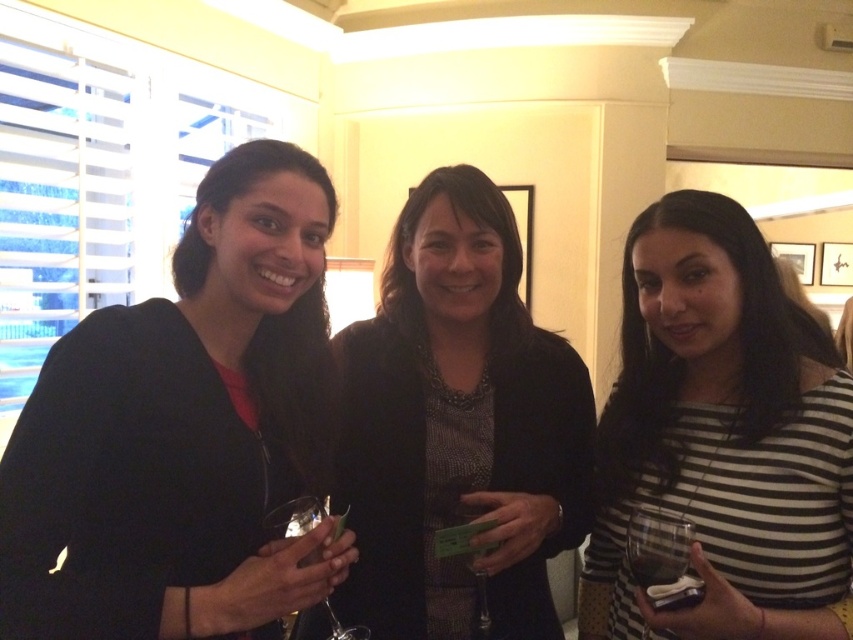
Between matte black blazer at center and clear glass wine glass at center, which one is positioned lower?

clear glass wine glass at center is below.

Which is more to the left, matte black blazer at center or clear glass wine glass at center?

From the viewer's perspective, clear glass wine glass at center appears more on the left side.

You are a GUI agent. You are given a task and a screenshot of the screen. Output one action in this format:
    pyautogui.click(x=<x>, y=<y>)
    Task: Click on the matte black blazer at center
    The height and width of the screenshot is (640, 853).
    Given the screenshot: What is the action you would take?
    pyautogui.click(x=457, y=426)

The height and width of the screenshot is (640, 853). Identify the location of matte black blazer at center. 457,426.

From the picture: Does matte black blazer at center have a larger size compared to clear glass wine glass at lower right?

Indeed, matte black blazer at center has a larger size compared to clear glass wine glass at lower right.

What do you see at coordinates (457, 426) in the screenshot?
I see `matte black blazer at center` at bounding box center [457, 426].

Locate an element on the screen. The image size is (853, 640). matte black blazer at center is located at coordinates (457, 426).

Is black matte sweater at left bigger than striped cotton shirt at right?

Incorrect, black matte sweater at left is not larger than striped cotton shirt at right.

This screenshot has width=853, height=640. Find the location of `black matte sweater at left`. black matte sweater at left is located at coordinates (183, 429).

Locate an element on the screen. The height and width of the screenshot is (640, 853). black matte sweater at left is located at coordinates (183, 429).